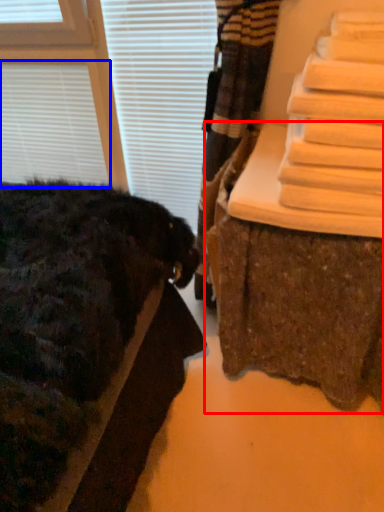
Question: Which point is closer to the camera, furniture (highlighted by a red box) or blind (highlighted by a blue box)?

Choices:
 (A) furniture
 (B) blind

Answer: (A)